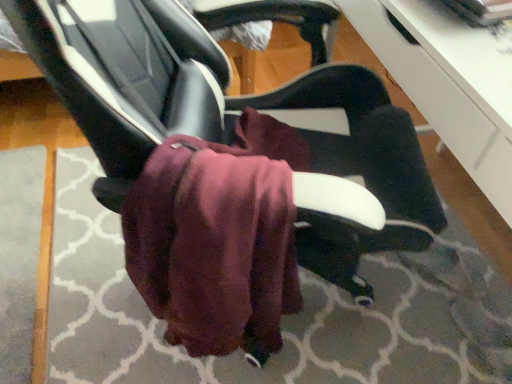
Question: Is burgundy fleece bath towel at center next to matte black chair at center?

Choices:
 (A) no
 (B) yes

Answer: (A)

Question: Is burgundy fleece bath towel at center further to the viewer compared to matte black chair at center?

Choices:
 (A) yes
 (B) no

Answer: (A)

Question: Is burgundy fleece bath towel at center completely or partially outside of matte black chair at center?

Choices:
 (A) yes
 (B) no

Answer: (B)

Question: Is matte black chair at center at the back of burgundy fleece bath towel at center?

Choices:
 (A) yes
 (B) no

Answer: (A)

Question: Is burgundy fleece bath towel at center surrounding matte black chair at center?

Choices:
 (A) no
 (B) yes

Answer: (A)

Question: Considering the relative sizes of burgundy fleece bath towel at center and matte black chair at center in the image provided, is burgundy fleece bath towel at center bigger than matte black chair at center?

Choices:
 (A) no
 (B) yes

Answer: (A)

Question: Considering the relative sizes of matte black chair at center and maroon fabric at center in the image provided, is matte black chair at center wider than maroon fabric at center?

Choices:
 (A) yes
 (B) no

Answer: (B)

Question: Is maroon fabric at center at the back of matte black chair at center?

Choices:
 (A) no
 (B) yes

Answer: (A)

Question: Is the surface of matte black chair at center in direct contact with maroon fabric at center?

Choices:
 (A) no
 (B) yes

Answer: (A)

Question: Is the depth of matte black chair at center less than that of maroon fabric at center?

Choices:
 (A) no
 (B) yes

Answer: (B)

Question: Is matte black chair at center oriented towards maroon fabric at center?

Choices:
 (A) yes
 (B) no

Answer: (B)

Question: From a real-world perspective, is matte black chair at center located beneath maroon fabric at center?

Choices:
 (A) yes
 (B) no

Answer: (B)

Question: Considering the relative sizes of maroon fabric at center and burgundy fleece bath towel at center in the image provided, is maroon fabric at center bigger than burgundy fleece bath towel at center?

Choices:
 (A) yes
 (B) no

Answer: (A)